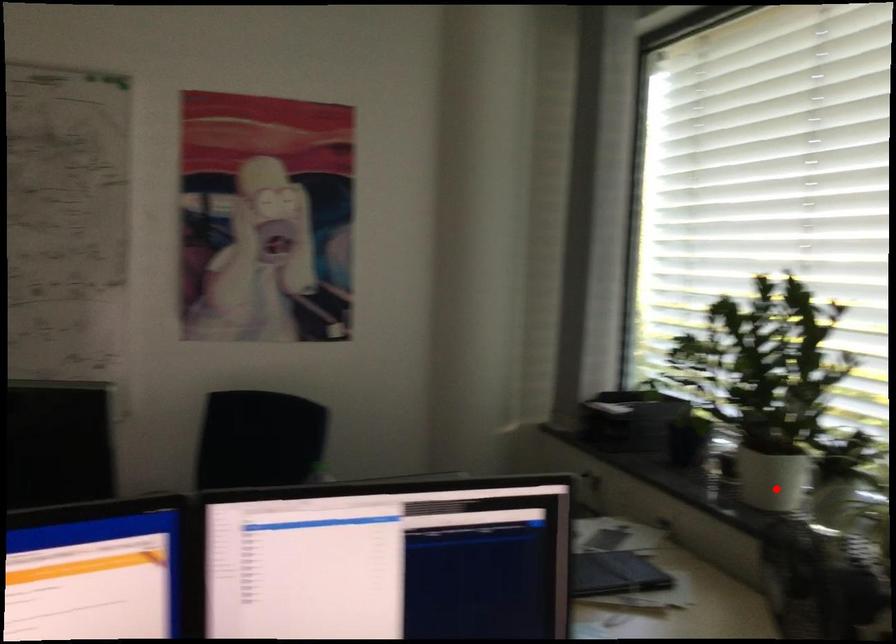
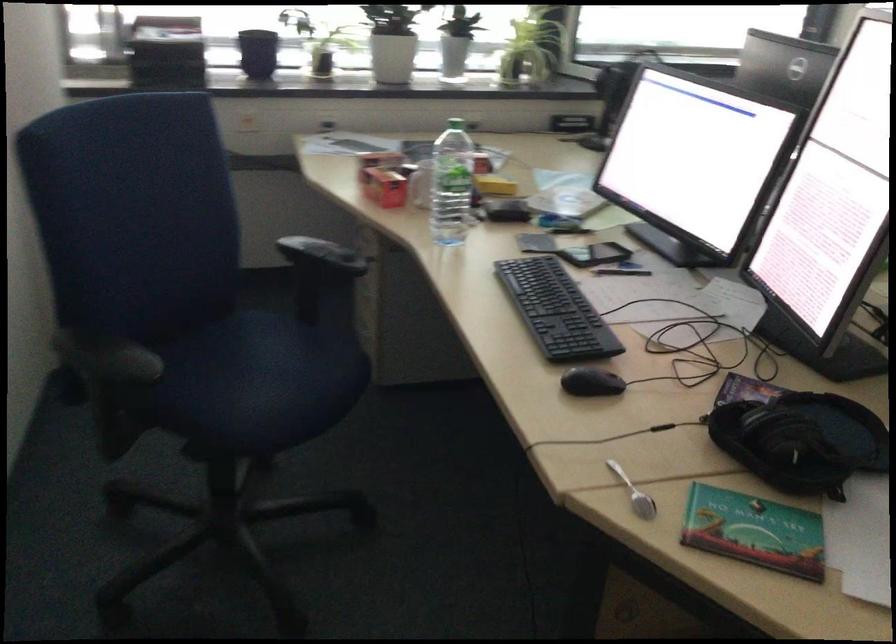
Question: I am providing you with two images of the same scene from different viewpoints. Given a red point in image1, look at the same physical point in image2. Is it:

Choices:
 (A) Closer to the viewpoint
 (B) Farther from the viewpoint

Answer: (B)